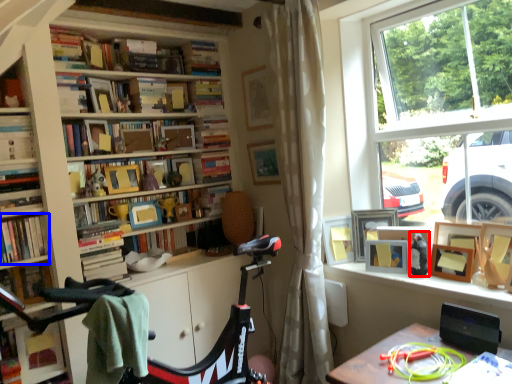
Question: Among these objects, which one is farthest to the camera, toy (highlighted by a red box) or book (highlighted by a blue box)?

Choices:
 (A) toy
 (B) book

Answer: (A)